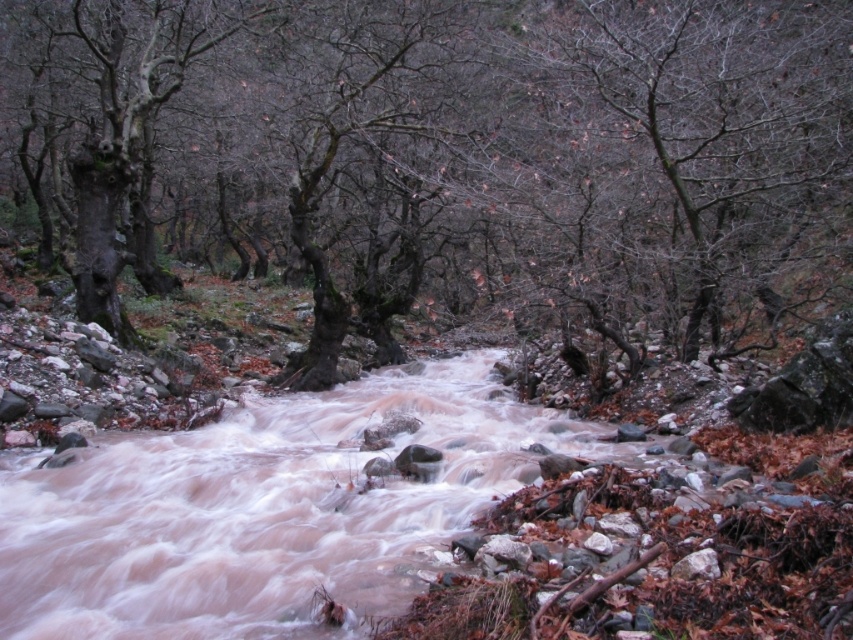
Question: Does smooth bark tree at upper right appear under dark brown rough bark tree at left?

Choices:
 (A) no
 (B) yes

Answer: (A)

Question: Is brown/rocky water at center smaller than dark brown rough bark tree at left?

Choices:
 (A) yes
 (B) no

Answer: (A)

Question: Among these points, which one is farthest from the camera?

Choices:
 (A) (369, 291)
 (B) (289, 547)

Answer: (A)

Question: Estimate the real-world distances between objects in this image. Which object is closer to the smooth bark tree at center?

Choices:
 (A) smooth bark tree at upper right
 (B) brown/rocky water at center

Answer: (A)

Question: Which point is farther from the camera taking this photo?

Choices:
 (A) (146, 12)
 (B) (180, 51)
 (C) (662, 260)

Answer: (A)

Question: Is smooth bark tree at upper right bigger than dark brown rough bark tree at left?

Choices:
 (A) no
 (B) yes

Answer: (A)